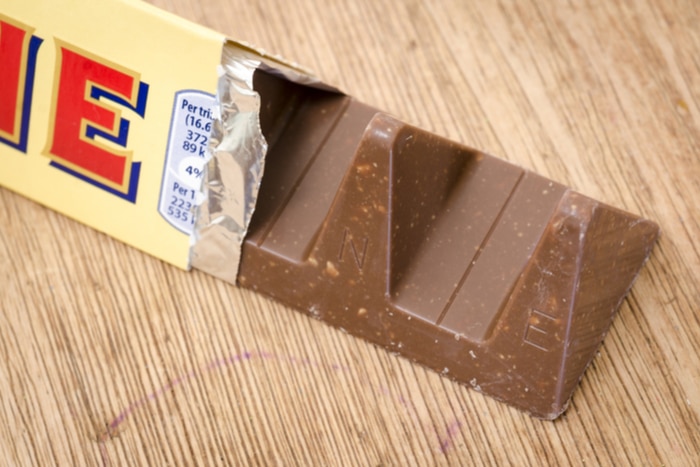
Find the location of a particular element. wooden table is located at coordinates (600, 108).